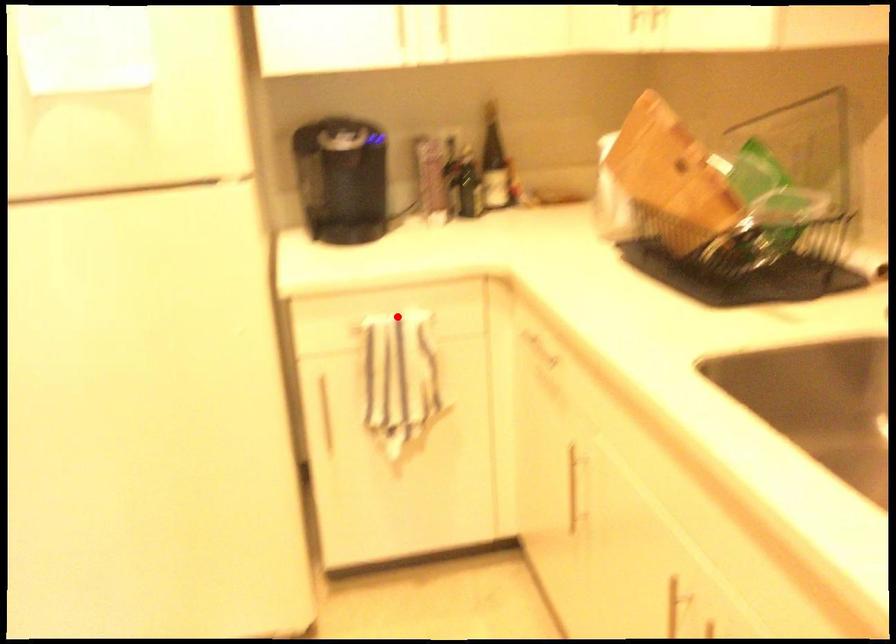
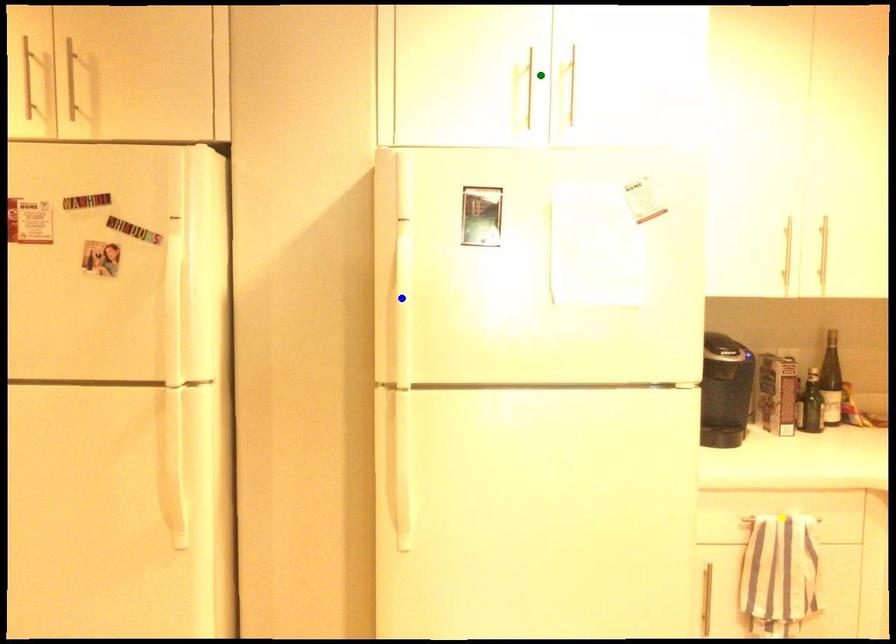
Question: I am providing you with two images of the same scene from different viewpoints. A red point is marked on the first image. You are given multiple points on the second image. Which point in image 2 represents the same 3d spot as the red point in image 1?

Choices:
 (A) green point
 (B) yellow point
 (C) blue point

Answer: (B)